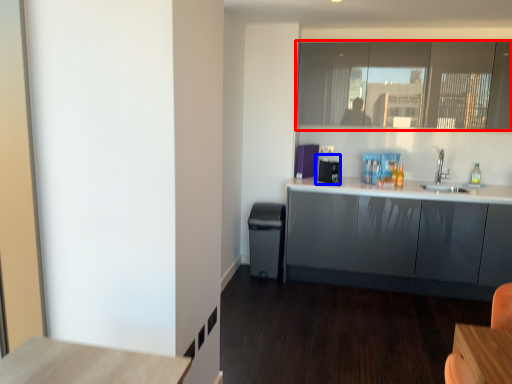
Question: Which of the following is the farthest to the observer, window (highlighted by a red box) or appliance (highlighted by a blue box)?

Choices:
 (A) window
 (B) appliance

Answer: (B)